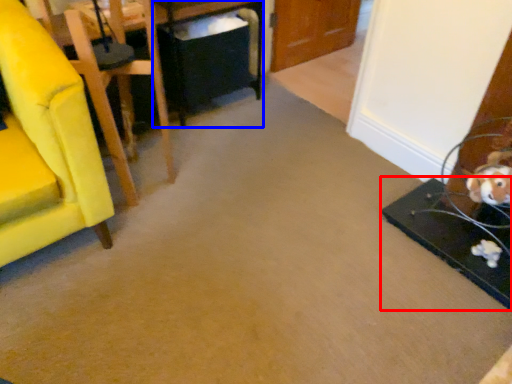
Question: Among these objects, which one is farthest to the camera, table (highlighted by a red box) or table (highlighted by a blue box)?

Choices:
 (A) table
 (B) table

Answer: (B)